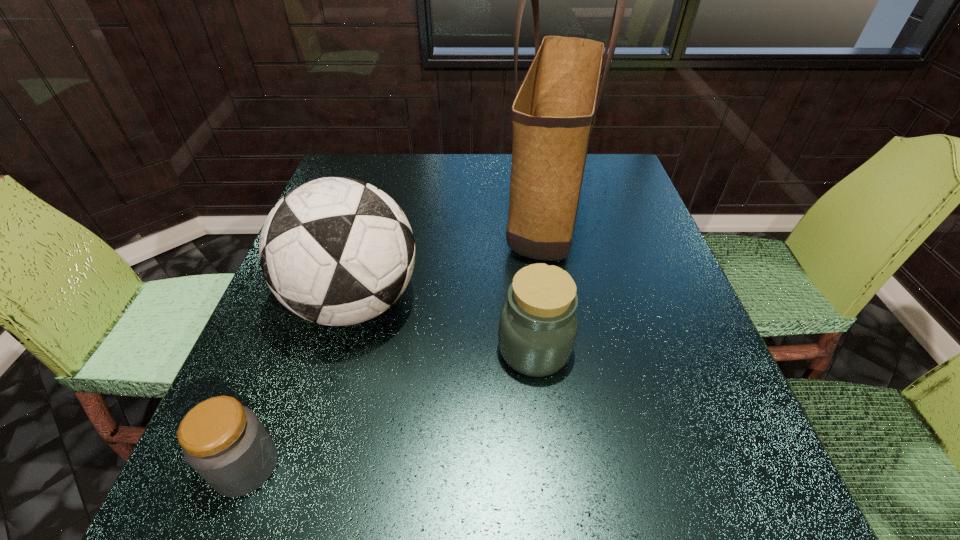
The image size is (960, 540). In order to click on vacant space at the far right corner of the desktop in this screenshot , I will do `click(610, 169)`.

Where is `free point at the near right corner`? The image size is (960, 540). free point at the near right corner is located at coordinates (711, 509).

You are a GUI agent. You are given a task and a screenshot of the screen. Output one action in this format:
    pyautogui.click(x=<x>, y=<y>)
    Task: Click on the free spot between the farther jar and the soccer ball
    
    Given the screenshot: What is the action you would take?
    pyautogui.click(x=444, y=326)

At what (x,y) coordinates should I click in order to perform the action: click on vacant area between the shorter jar and the taller jar. Please return your answer as a coordinate pair (x, y). This screenshot has width=960, height=540. Looking at the image, I should click on (391, 408).

Locate an element on the screen. This screenshot has height=540, width=960. vacant space that is in between the third tallest object and the soccer ball is located at coordinates (444, 326).

Identify the location of free space that is in between the shortest object and the taller jar. The image size is (960, 540). (391, 408).

Identify the location of vacant area that lies between the tallest object and the nearer jar. (396, 338).

Identify the location of vacant space that's between the nearest object and the taller jar. The width and height of the screenshot is (960, 540). (391, 408).

Where is `vacant area that lies between the farther jar and the nearest object`? This screenshot has height=540, width=960. vacant area that lies between the farther jar and the nearest object is located at coordinates (391, 408).

Identify the location of free space that is in between the taller jar and the shorter jar. (391, 408).